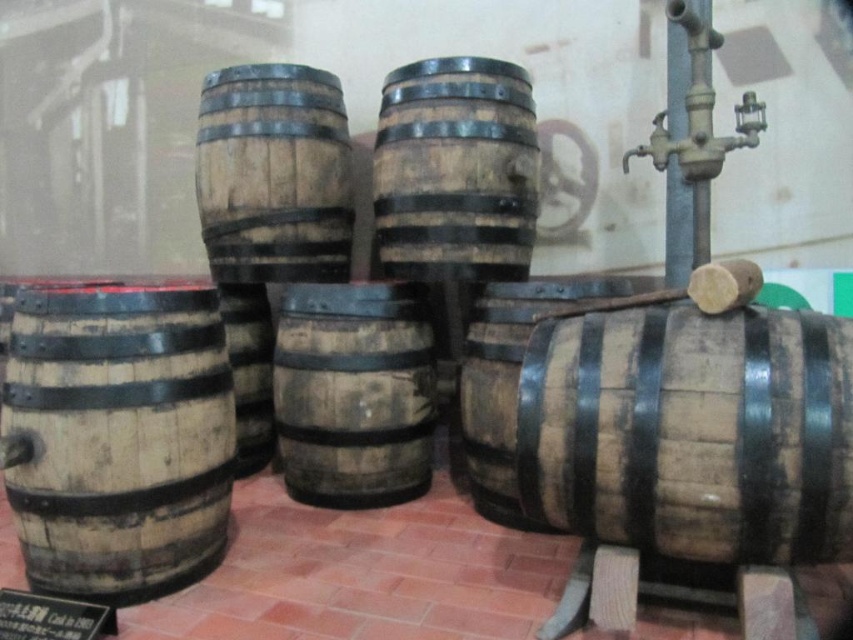
Does wooden barrel at left appear over wooden barrel at center?

No, wooden barrel at left is not above wooden barrel at center.

Between wooden barrel at left and wooden barrel at center, which one is positioned lower?

wooden barrel at left

What do you see at coordinates (117, 438) in the screenshot?
I see `wooden barrel at left` at bounding box center [117, 438].

Where is `wooden barrel at left`? wooden barrel at left is located at coordinates (117, 438).

Is dark brown wood barrel at center positioned in front of wooden barrel at center?

Yes, it is.

Between dark brown wood barrel at center and wooden barrel at center, which one appears on the left side from the viewer's perspective?

wooden barrel at center is more to the left.

In the scene shown: Who is more distant from viewer, (363, 342) or (318, 100)?

Point (318, 100)

Where is `dark brown wood barrel at center`? The image size is (853, 640). dark brown wood barrel at center is located at coordinates (352, 394).

Can you confirm if wooden barrel at left is positioned below weathered wood barrel at center?

Yes.

Is point (32, 300) more distant than point (373, 196)?

That is False.

Where is `wooden barrel at left`? This screenshot has width=853, height=640. wooden barrel at left is located at coordinates (117, 438).